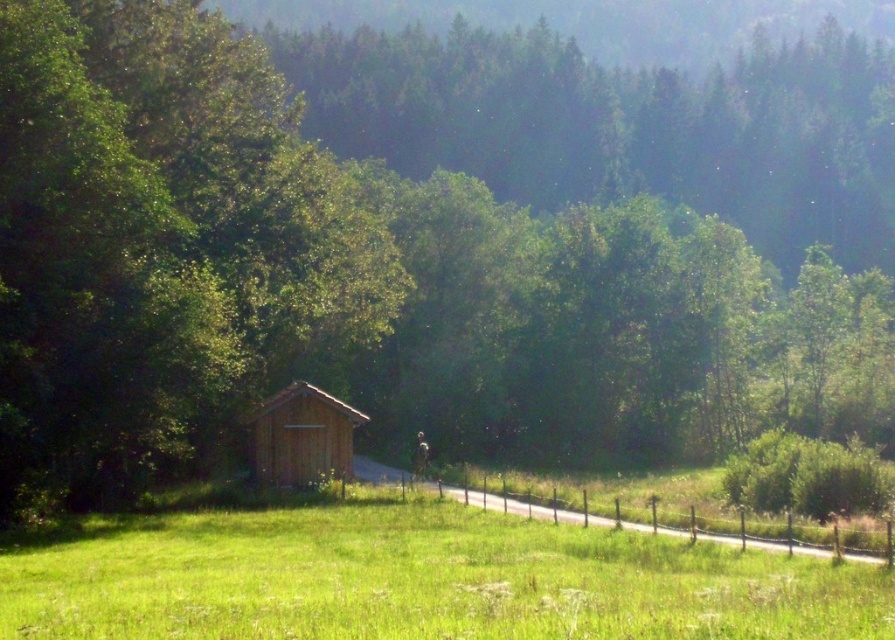
Question: Does green grassy field at center appear on the left side of wooden cabin at center?

Choices:
 (A) no
 (B) yes

Answer: (A)

Question: Which point is closer to the camera taking this photo?

Choices:
 (A) (855, 564)
 (B) (342, 404)

Answer: (A)

Question: Does green grassy field at center appear over wooden cabin at center?

Choices:
 (A) yes
 (B) no

Answer: (B)

Question: Is green grassy field at center thinner than wooden cabin at center?

Choices:
 (A) no
 (B) yes

Answer: (A)